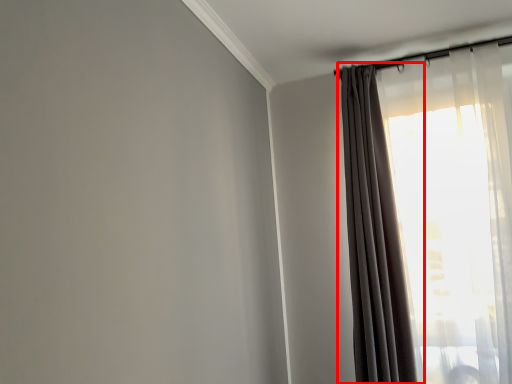
Question: Where is curtain (annotated by the red box) located in relation to curtain in the image?

Choices:
 (A) right
 (B) left

Answer: (B)